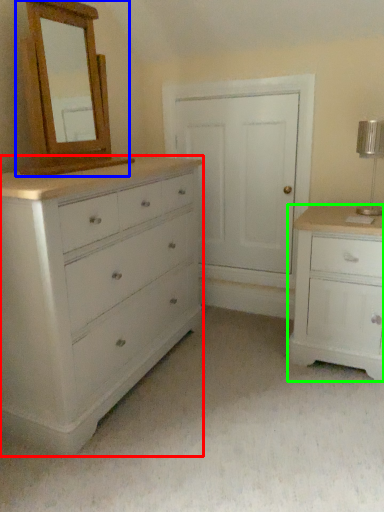
Question: Estimate the real-world distances between objects in this image. Which object is farther from chest of drawers (highlighted by a red box), medicine cabinet (highlighted by a blue box) or chest of drawers (highlighted by a green box)?

Choices:
 (A) medicine cabinet
 (B) chest of drawers

Answer: (B)